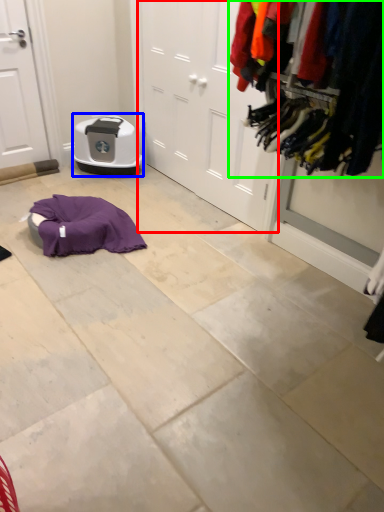
Question: Which object is positioned farthest from door (highlighted by a red box)? Select from appliance (highlighted by a blue box) and closet (highlighted by a green box).

Choices:
 (A) appliance
 (B) closet

Answer: (B)